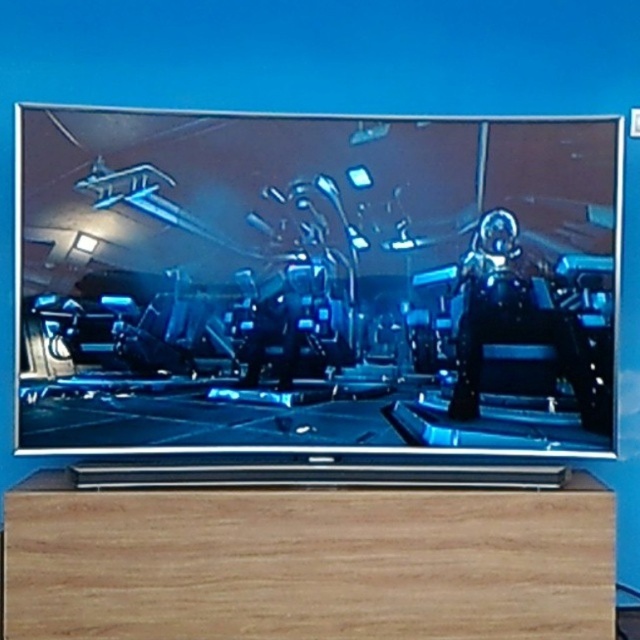
Which is behind, point (380, 342) or point (266, 497)?

The point (380, 342) is more distant.

In the scene shown: Is glossy metallic spaceship at center closer to camera compared to wooden drawer at bottom?

No, it is behind wooden drawer at bottom.

The image size is (640, 640). Describe the element at coordinates (316, 282) in the screenshot. I see `glossy metallic spaceship at center` at that location.

Identify the location of glossy metallic spaceship at center. The image size is (640, 640). (316, 282).